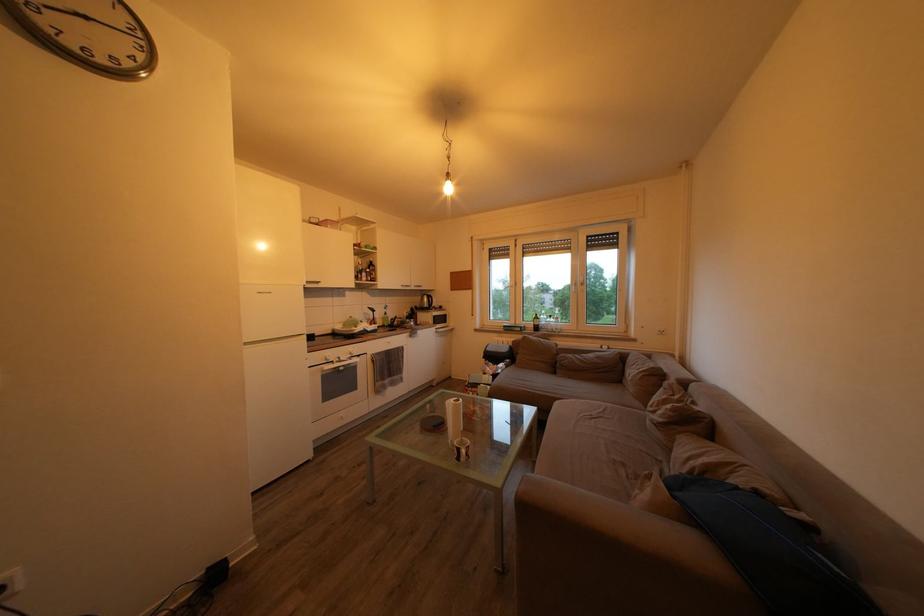
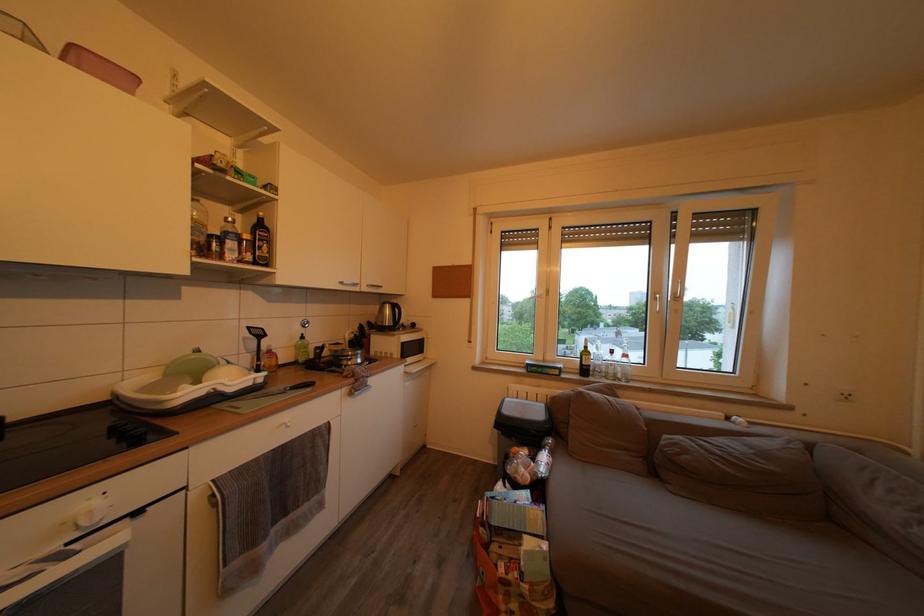
The point at [375,277] is marked in the first image. Where is the corresponding point in the second image?

(253, 243)